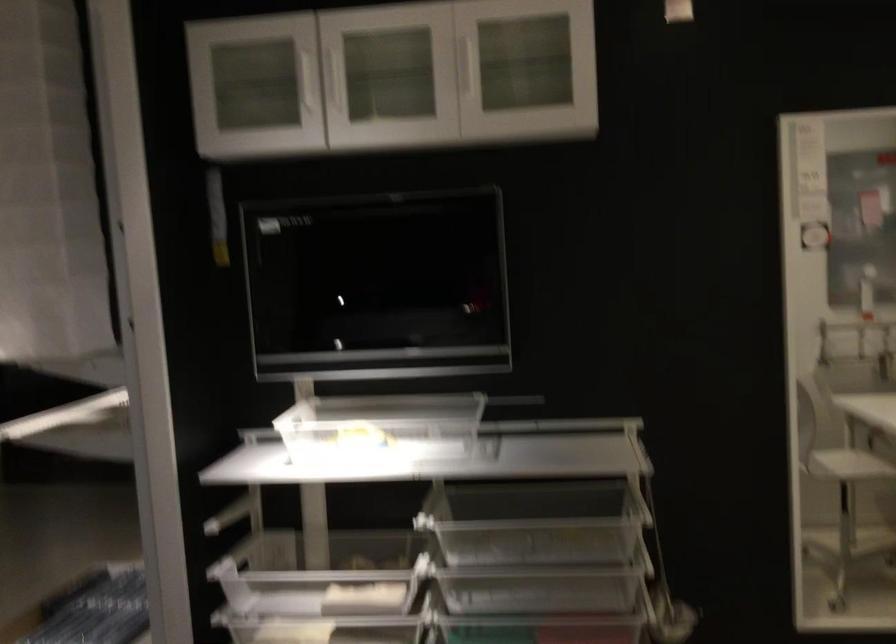
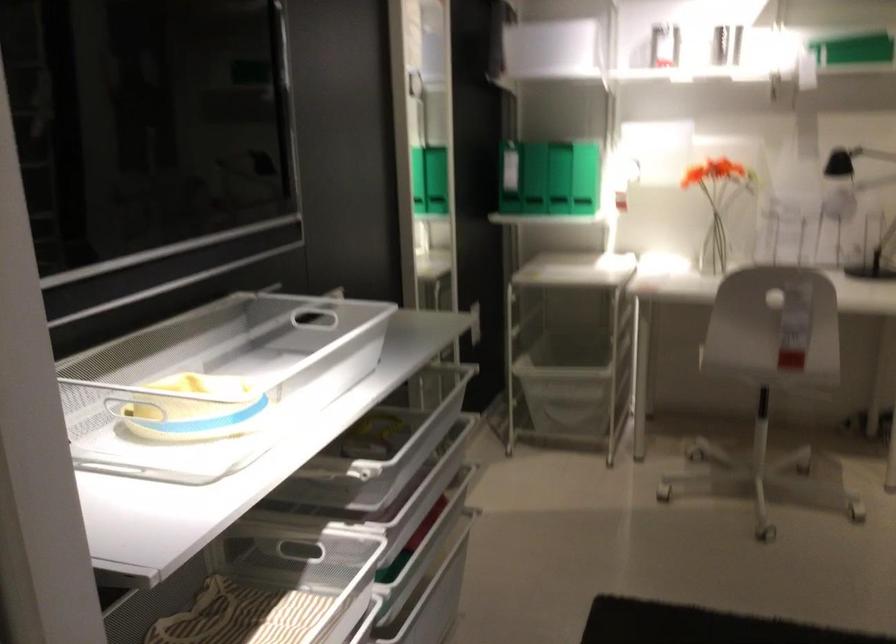
Where in the second image is the point corresponding to point 354,457 from the first image?

(216, 383)